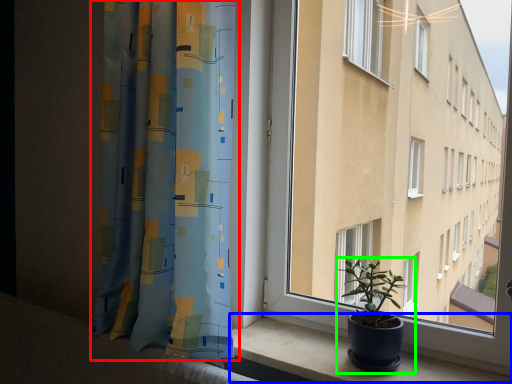
Question: Considering the real-world distances, which object is closest to curtain (highlighted by a red box)? window sill (highlighted by a blue box) or houseplant (highlighted by a green box).

Choices:
 (A) window sill
 (B) houseplant

Answer: (A)